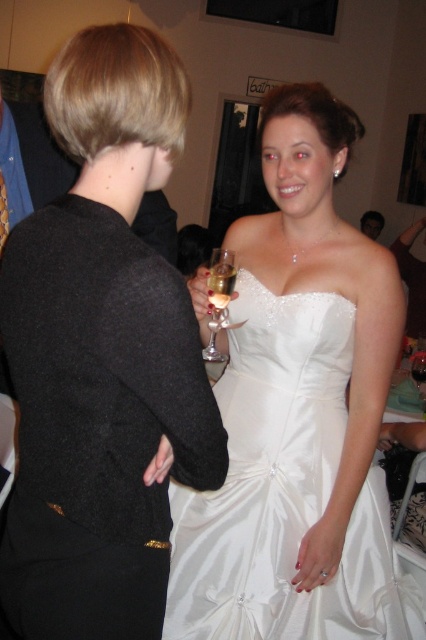
You are a photographer at the wedding reception. You want to take a closeup shot of the black wool sweater at left without moving the subject. Is it possible to do so with your current camera settings that require a minimum focus distance of 30 inches?

The black wool sweater at left is 30.49 inches away from the camera, which is slightly more than the required 30 inches minimum focus distance. Therefore, it is possible to take a closeup shot without moving the subject.

You are a photographer at the wedding reception and want to capture a photo of both the point at (409, 259) and the point at (370, 221). Which point is closer to the camera?

Point at (409, 259) is closer to the camera because it is in front of point at (370, 221).

You are at the wedding reception and want to take a photo of the two points mentioned. Which point, point (213, 305) or point (420, 364), is closer to you?

Point (213, 305) is closer to the viewer than point (420, 364).